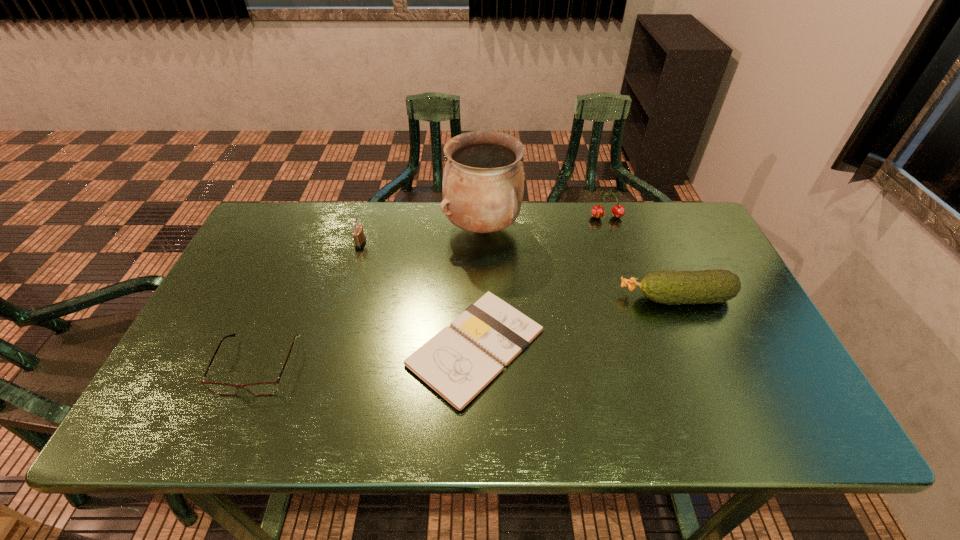
The height and width of the screenshot is (540, 960). Identify the location of vacant space that is in between the fifth tallest object and the cherry. (433, 292).

Identify the location of free area in between the tallest object and the spectacles. (371, 297).

Locate an element on the screen. vacant space that's between the cherry and the tallest object is located at coordinates (544, 223).

Where is `blank region between the tallest object and the fifth object from right to left`? blank region between the tallest object and the fifth object from right to left is located at coordinates (421, 236).

Where is `vacant space in between the cucumber and the cherry`? The image size is (960, 540). vacant space in between the cucumber and the cherry is located at coordinates (641, 258).

Identify the location of free point between the tallest object and the notepad. This screenshot has width=960, height=540. (479, 288).

The image size is (960, 540). In order to click on object that can be found as the fifth closest to the notepad in this screenshot , I will do `click(618, 211)`.

The image size is (960, 540). I want to click on object that stands as the third closest to the cherry, so click(458, 367).